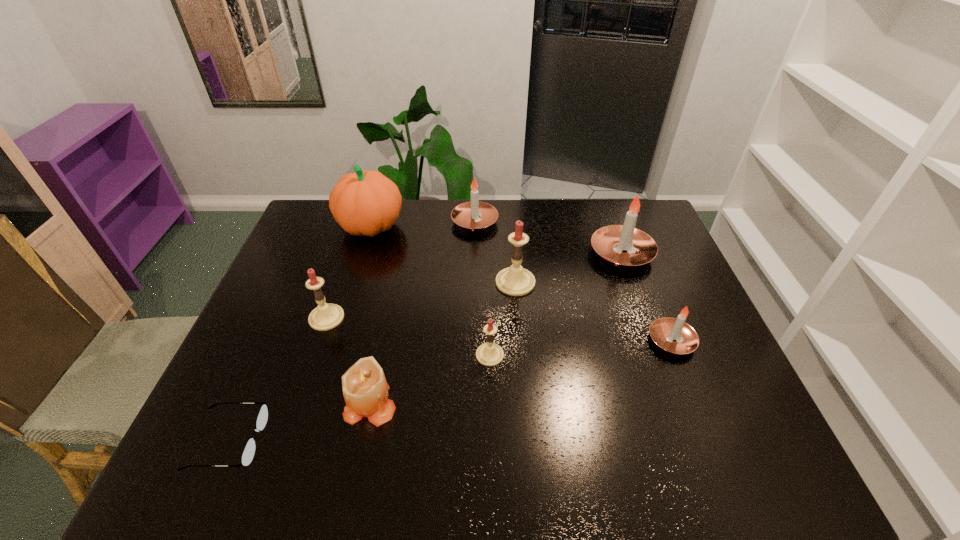
I want to click on vacant space in between the smallest white candle and the leftmost white candle, so click(x=573, y=281).

I want to click on free spot between the leftmost candle and the pumpkin, so click(348, 272).

Where is `vacant space that is in between the biggest red candle and the nearest candle`? Image resolution: width=960 pixels, height=540 pixels. vacant space that is in between the biggest red candle and the nearest candle is located at coordinates (443, 343).

Where is `object that is the seventh closest to the biggest white candle`? The image size is (960, 540). object that is the seventh closest to the biggest white candle is located at coordinates (325, 316).

Identify the location of object that is the third closest to the orange pumpkin. The width and height of the screenshot is (960, 540). coord(515,280).

Identify the location of candle that stands as the third closest to the smallest red candle. This screenshot has height=540, width=960. (325, 316).

Identify the location of candle that stands as the third closest to the beige candle. [515, 280].

This screenshot has width=960, height=540. What are the coordinates of `white candle that is the closest one to the second biggest white candle` in the screenshot? It's located at (624, 245).

Choose which white candle is the third nearest neighbor to the second smallest red candle. Please provide its 2D coordinates. Your answer should be formatted as a tuple, i.e. [(x, y)], where the tuple contains the x and y coordinates of a point satisfying the conditions above.

[(674, 335)]

Identify the location of red candle that is the second nearest to the leftmost white candle. (325, 316).